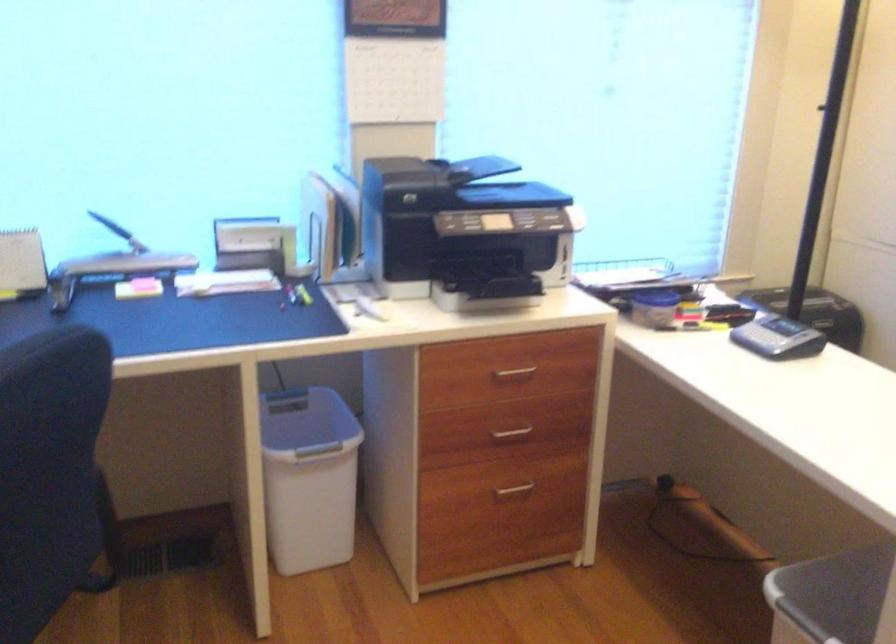
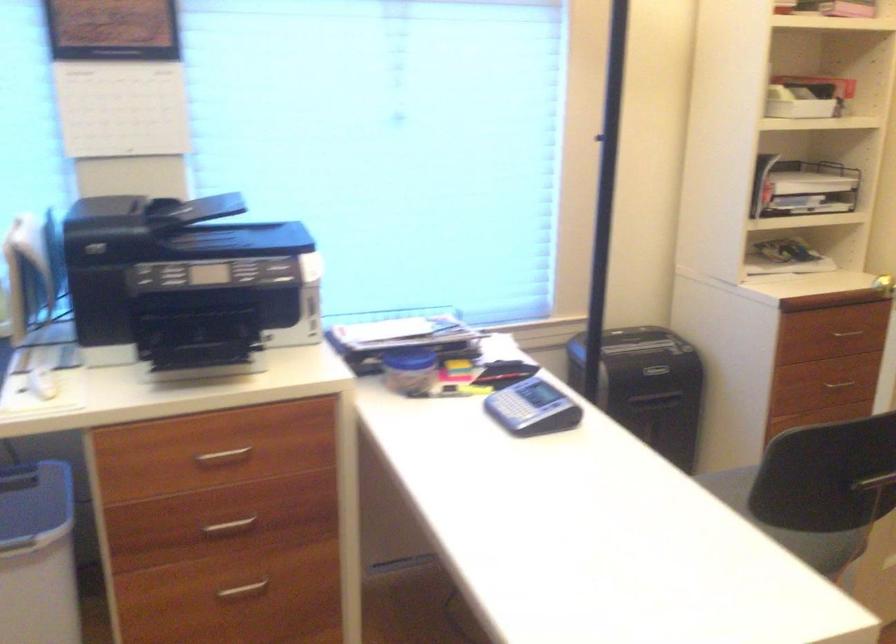
The images are taken continuously from a first-person perspective. In which direction are you moving?

The cameraman moved toward right, forward.